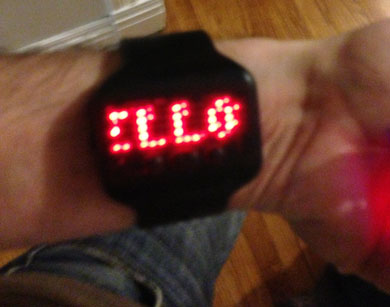
This screenshot has width=390, height=307. Identify the location of flooring. (238, 267).